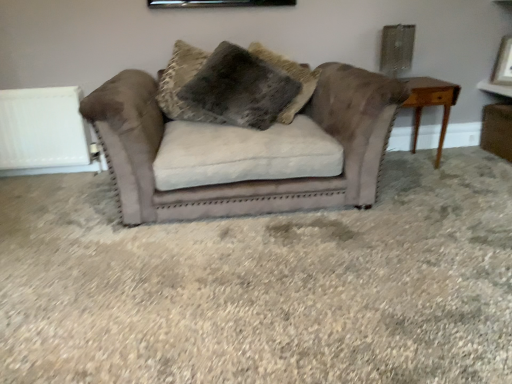
Find the location of a particular element. free region under light brown wooden table at right (from a real-world perspective) is located at coordinates (406, 167).